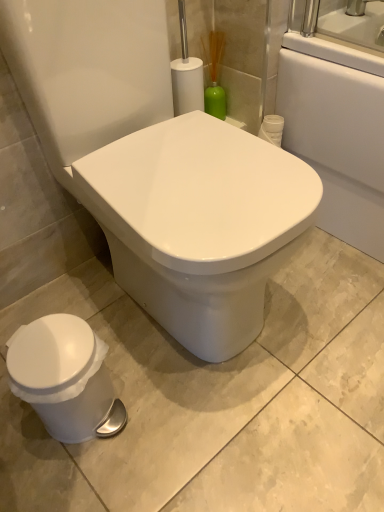
Where is `blank space situated above white plastic trash can at lower left (from a real-world perspective)`? blank space situated above white plastic trash can at lower left (from a real-world perspective) is located at coordinates (49, 348).